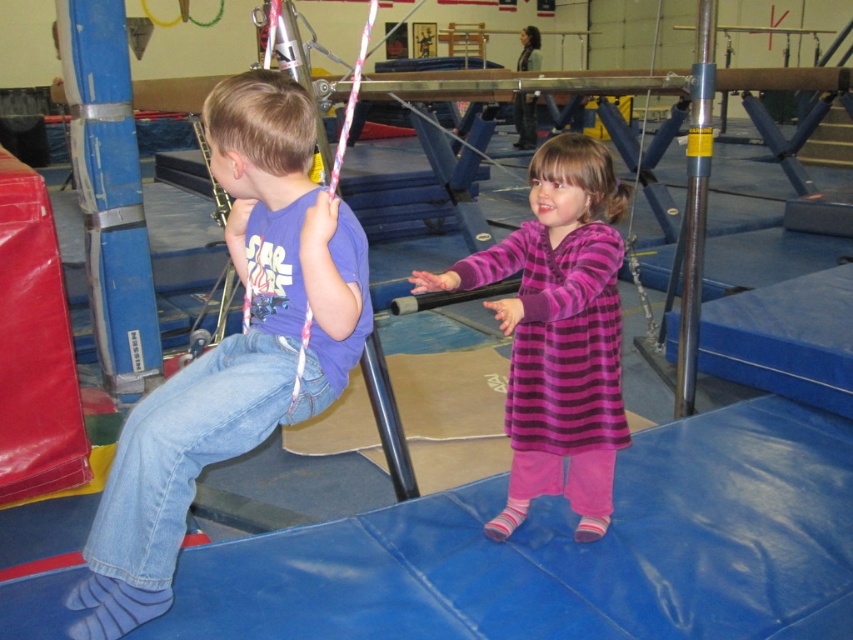
Based on the coordinates provided, which object is located at point (109, 192) in the scene?

The blue rubber pole at left is located at point (109, 192) in the scene.

You are a gymnastics instructor observing the children in the scene. You notice the purple striped dress at center and the blue rubber pole at left. Which object is positioned lower in the image?

The purple striped dress at center is below the blue rubber pole at left, so the purple striped dress at center is positioned lower in the image.

In the scene shown: You are a gymnast trying to navigate between two points in the facility. The first point is at coordinates point (136, 320) and the second is at point (698, 326). Based on the scene description, which point is closer to the gymnast when facing forward?

Point (136, 320) is behind point (698, 326), so the closer point to the gymnast when facing forward would be point (698, 326).